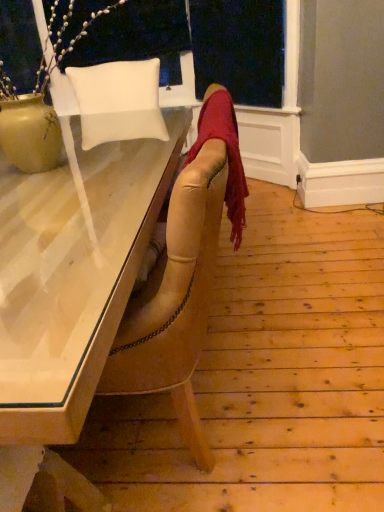
Question: From the image's perspective, does white leather pillow at upper left appear higher than velvet red scarf at center?

Choices:
 (A) yes
 (B) no

Answer: (A)

Question: Is white leather pillow at upper left behind velvet red scarf at center?

Choices:
 (A) yes
 (B) no

Answer: (A)

Question: From a real-world perspective, is white leather pillow at upper left positioned over velvet red scarf at center based on gravity?

Choices:
 (A) no
 (B) yes

Answer: (A)

Question: From a real-world perspective, is white leather pillow at upper left under velvet red scarf at center?

Choices:
 (A) yes
 (B) no

Answer: (A)

Question: Does white leather pillow at upper left have a lesser height compared to velvet red scarf at center?

Choices:
 (A) yes
 (B) no

Answer: (B)

Question: Relative to white leather pillow at upper left, is matte white desk at center in front or behind?

Choices:
 (A) behind
 (B) front

Answer: (B)

Question: Is matte white desk at center wider or thinner than white leather pillow at upper left?

Choices:
 (A) thin
 (B) wide

Answer: (B)

Question: Is point (54, 392) closer or farther from the camera than point (148, 83)?

Choices:
 (A) farther
 (B) closer

Answer: (B)

Question: From a real-world perspective, is matte white desk at center above or below white leather pillow at upper left?

Choices:
 (A) below
 (B) above

Answer: (A)

Question: In the image, is white leather pillow at upper left on the left side or the right side of matte ceramic vase at upper left?

Choices:
 (A) left
 (B) right

Answer: (B)

Question: From the image's perspective, is white leather pillow at upper left above or below matte ceramic vase at upper left?

Choices:
 (A) above
 (B) below

Answer: (A)

Question: Looking at the image, does white leather pillow at upper left seem bigger or smaller compared to matte ceramic vase at upper left?

Choices:
 (A) big
 (B) small

Answer: (B)

Question: Considering the positions of point (99, 135) and point (44, 111), is point (99, 135) closer or farther from the camera than point (44, 111)?

Choices:
 (A) farther
 (B) closer

Answer: (A)

Question: Looking at their shapes, would you say matte white desk at center is wider or thinner than velvet red scarf at center?

Choices:
 (A) thin
 (B) wide

Answer: (B)

Question: Relative to velvet red scarf at center, is matte white desk at center in front or behind?

Choices:
 (A) front
 (B) behind

Answer: (A)